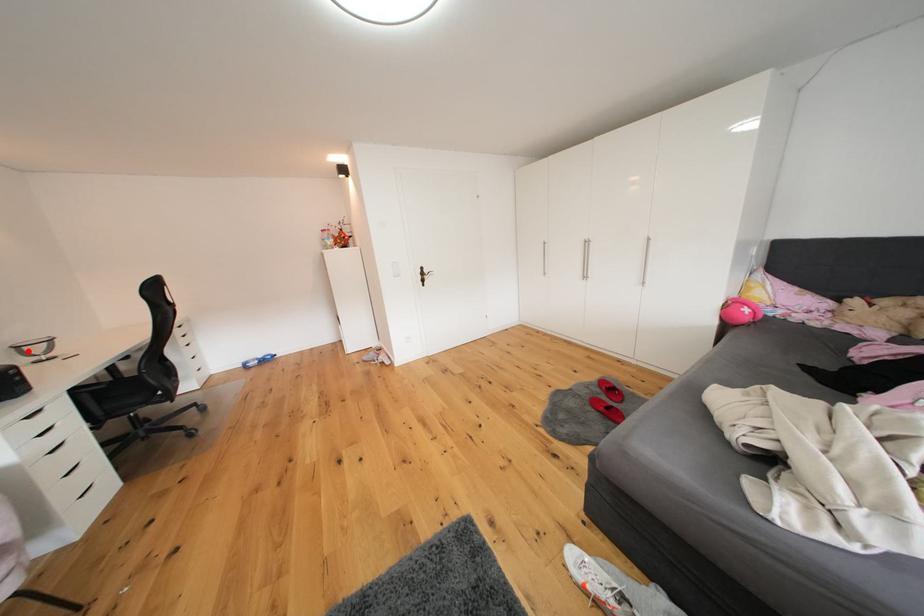
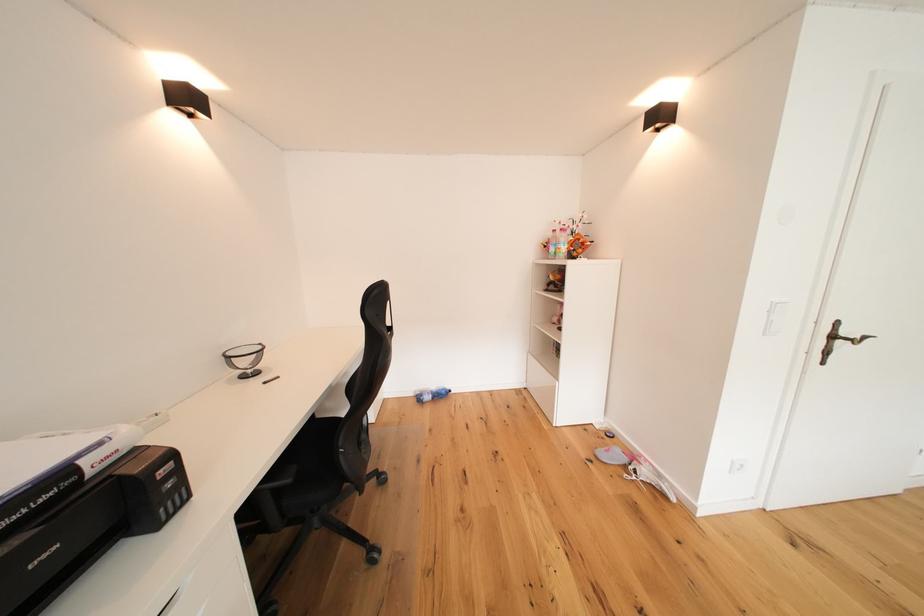
Question: I am providing you with two images of the same scene from different viewpoints. Image1 has a red point marked. In image2, the corresponding 3D location appears at what relative position? Reply with the corresponding letter.

Choices:
 (A) Closer
 (B) Farther

Answer: (A)